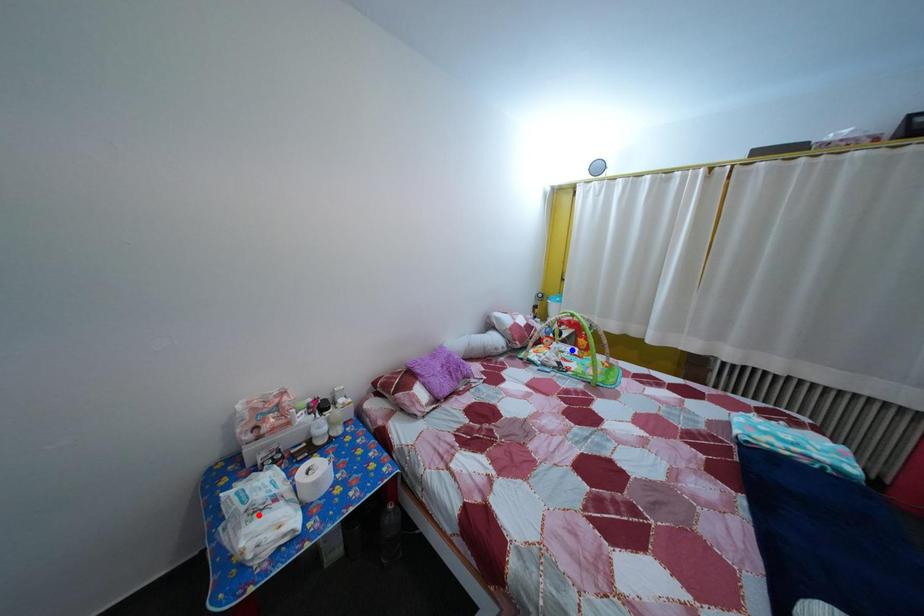
Question: In the image, two points are highlighted. Which point is nearer to the camera? Reply with the corresponding letter.

Choices:
 (A) blue point
 (B) red point

Answer: (B)